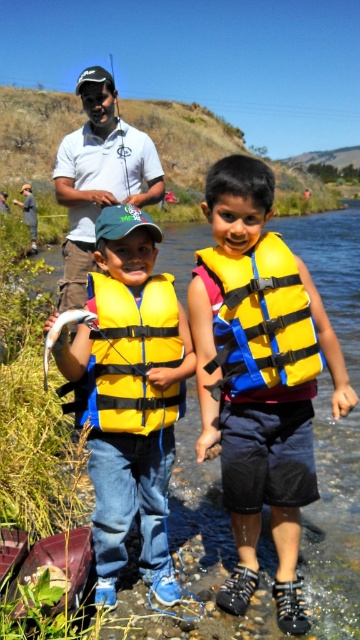
You are a photographer trying to capture a closeup of the yellow matte life jacket at center and the matte white polo shirt at upper center. Which object should you focus on first to ensure it appears sharp in your photo?

The yellow matte life jacket at center should be focused on first since it is closer to the viewer than the matte white polo shirt at upper center, ensuring it appears sharp before adjusting focus for the background.

You are a photographer at the scene. You need to take a photo that includes both the yellow matte life jacket at center and the matte white polo shirt at upper center. Which object should be placed closer to the camera to ensure both are fully visible in the photo?

The yellow matte life jacket at center is shorter than the matte white polo shirt at upper center. To ensure both are fully visible in the photo, the yellow matte life jacket at center should be placed closer to the camera since it is shorter and might be obscured by the taller matte white polo shirt at upper center if positioned farther away.

You are a photographer at the event and need to place a small award plaque between the two boys. The plaque is 12 inches wide. Can you fit it between the yellow life vest at center and the yellow matte life jacket at center?

The yellow life vest at center is wider than the yellow matte life jacket at center. Since the plaque is 12 inches wide, you need to check the distance between them. However, the description only states the width of the vests, not the distance between them. Therefore, we cannot determine if the plaque will fit based on the given information.